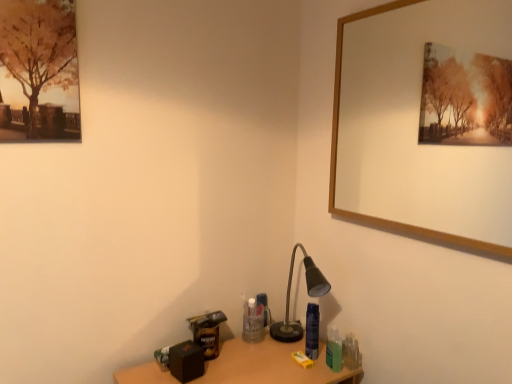
Question: Can you confirm if wooden picture frame at upper right is shorter than wooden table at lower center?

Choices:
 (A) no
 (B) yes

Answer: (A)

Question: From a real-world perspective, is wooden picture frame at upper right physically above wooden table at lower center?

Choices:
 (A) yes
 (B) no

Answer: (A)

Question: Is wooden picture frame at upper right positioned behind wooden table at lower center?

Choices:
 (A) no
 (B) yes

Answer: (A)

Question: Is wooden picture frame at upper right outside of wooden table at lower center?

Choices:
 (A) no
 (B) yes

Answer: (B)

Question: Considering the relative positions of wooden picture frame at upper right and wooden table at lower center in the image provided, is wooden picture frame at upper right to the left of wooden table at lower center from the viewer's perspective?

Choices:
 (A) yes
 (B) no

Answer: (B)

Question: Is wooden table at lower center inside wooden picture frame at upper right?

Choices:
 (A) no
 (B) yes

Answer: (A)

Question: Is matte black desk lamp at lower right not inside wooden picture frame at upper right?

Choices:
 (A) no
 (B) yes

Answer: (B)

Question: Can you confirm if matte black desk lamp at lower right is shorter than wooden picture frame at upper right?

Choices:
 (A) yes
 (B) no

Answer: (A)

Question: Is the depth of matte black desk lamp at lower right less than that of wooden picture frame at upper right?

Choices:
 (A) no
 (B) yes

Answer: (A)

Question: Is matte black desk lamp at lower right positioned with its back to wooden picture frame at upper right?

Choices:
 (A) no
 (B) yes

Answer: (A)

Question: From a real-world perspective, is matte black desk lamp at lower right positioned under wooden picture frame at upper right based on gravity?

Choices:
 (A) no
 (B) yes

Answer: (B)

Question: Is matte black desk lamp at lower right to the left of wooden picture frame at upper right from the viewer's perspective?

Choices:
 (A) no
 (B) yes

Answer: (B)

Question: Is matte black desk lamp at lower right positioned beyond the bounds of wooden table at lower center?

Choices:
 (A) yes
 (B) no

Answer: (A)